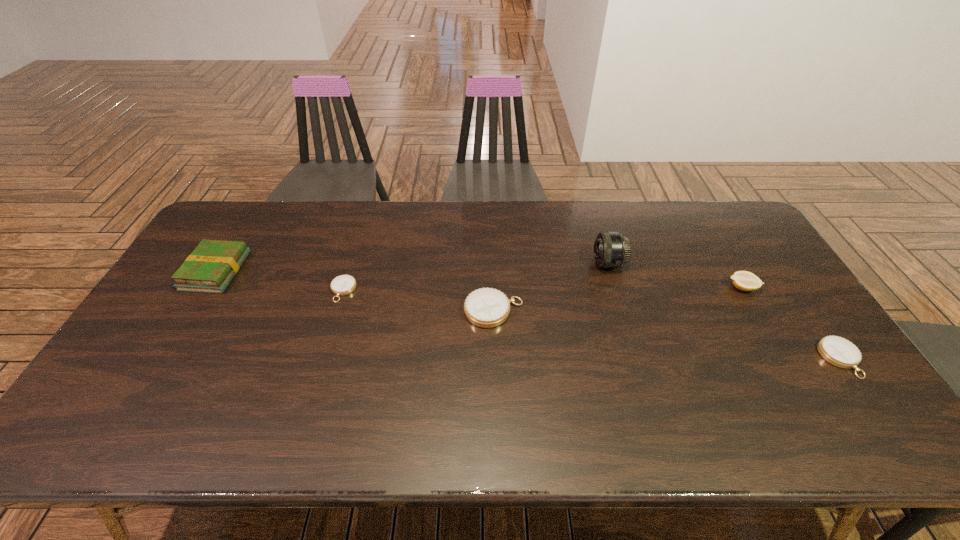
Where is `unoccupied area between the shortest object and the second tallest compass`? The image size is (960, 540). unoccupied area between the shortest object and the second tallest compass is located at coordinates (591, 325).

Find the location of a particular element. Image resolution: width=960 pixels, height=540 pixels. vacant area that lies between the second object from right to left and the nearest object is located at coordinates (791, 323).

This screenshot has height=540, width=960. What are the coordinates of `unoccupied position between the fifth tallest object and the second compass from left to right` in the screenshot? It's located at tap(667, 335).

The image size is (960, 540). I want to click on free space between the lemon and the shortest object, so click(542, 289).

Find the location of a particular element. This screenshot has width=960, height=540. vacant space in between the rightmost object and the book is located at coordinates (528, 315).

Locate an element on the screen. Image resolution: width=960 pixels, height=540 pixels. vacant area between the leftmost compass and the nearest compass is located at coordinates (591, 325).

Locate an element on the screen. The image size is (960, 540). free space that is in between the tallest compass and the book is located at coordinates (355, 291).

Where is `vacant area between the fifth object from left to right and the leftmost object`? Image resolution: width=960 pixels, height=540 pixels. vacant area between the fifth object from left to right and the leftmost object is located at coordinates (479, 279).

The image size is (960, 540). I want to click on free spot between the leftmost compass and the telephoto lens, so click(x=476, y=276).

Find the location of `empty space that is in between the shortest object and the fifth shortest object`. empty space that is in between the shortest object and the fifth shortest object is located at coordinates (279, 280).